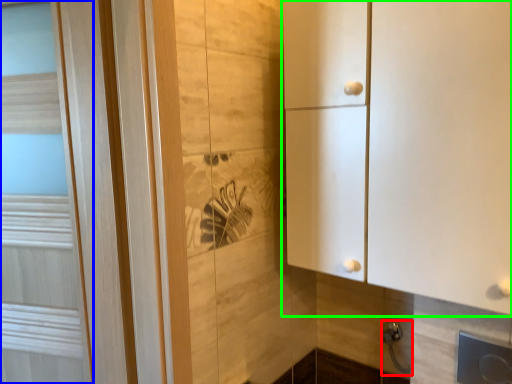
Question: Estimate the real-world distances between objects in this image. Which object is farther from door handle (highlighted by a red box), door (highlighted by a blue box) or cupboard (highlighted by a green box)?

Choices:
 (A) door
 (B) cupboard

Answer: (A)